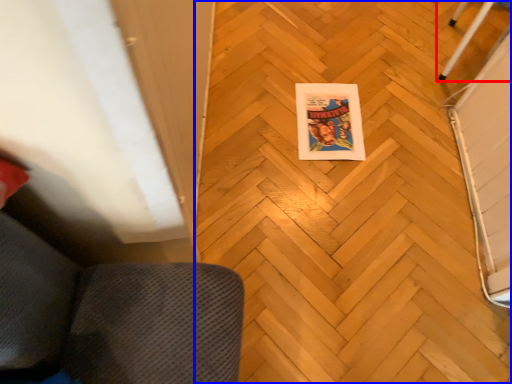
Question: Which point is further to the camera, furniture (highlighted by a red box) or plywood (highlighted by a blue box)?

Choices:
 (A) furniture
 (B) plywood

Answer: (A)